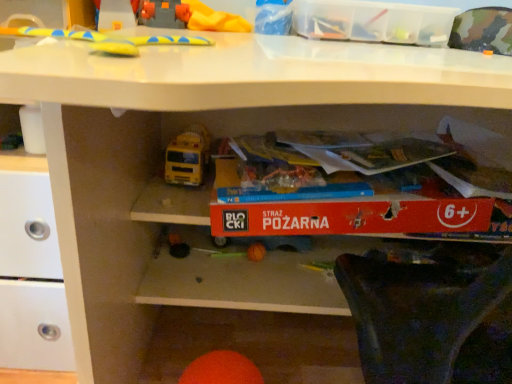
This screenshot has width=512, height=384. Describe the element at coordinates (106, 39) in the screenshot. I see `yellow rubber toy at upper center, the 2th toy in the bottom-to-top sequence` at that location.

Where is `transparent plastic storage box at upper center`? transparent plastic storage box at upper center is located at coordinates (373, 22).

You are a GUI agent. You are given a task and a screenshot of the screen. Output one action in this format:
    pyautogui.click(x=<x>, y=<y>)
    Task: Click on the yellow rubber toy at upper center, which appears as the 1th toy when viewed from the front
    The height and width of the screenshot is (384, 512).
    Given the screenshot: What is the action you would take?
    pyautogui.click(x=106, y=39)

Which of these two, yellow rubber toy at upper center, which is the 3th toy from bottom to top, or yellow rubber toy at upper center, which appears as the 1th toy when viewed from the front, stands taller?

yellow rubber toy at upper center, which is the 3th toy from bottom to top.

Is yellow rubber toy at upper center, which appears as the 1th toy when viewed from the front, surrounded by yellow rubber toy at upper center, which is the 3th toy from bottom to top?

No, yellow rubber toy at upper center, which appears as the 1th toy when viewed from the front, is not a part of yellow rubber toy at upper center, which is the 3th toy from bottom to top.

Is point (223, 16) positioned in front of point (203, 41)?

No.

Is yellow rubber toy at upper center, which is the 2th toy from top to bottom, at the back of yellow rubber toy at upper center, the first toy positioned from the top?

No, yellow rubber toy at upper center, the first toy positioned from the top,'s orientation is not away from yellow rubber toy at upper center, which is the 2th toy from top to bottom.

Is yellow rubber toy at upper center, acting as the 1th toy starting from the back, outside of transparent plastic storage box at upper center?

Yes, yellow rubber toy at upper center, acting as the 1th toy starting from the back, is not within transparent plastic storage box at upper center.

Considering the positions of point (243, 22) and point (436, 16), is point (243, 22) closer or farther from the camera than point (436, 16)?

Point (243, 22).

From a real-world perspective, relative to transparent plastic storage box at upper center, is yellow rubber toy at upper center, the first toy positioned from the top, vertically above or below?

yellow rubber toy at upper center, the first toy positioned from the top, is situated higher than transparent plastic storage box at upper center in the real world.

Locate an element on the screen. This screenshot has height=384, width=512. storage box directly beneath the yellow rubber toy at upper center, acting as the 1th toy starting from the back (from a real-world perspective) is located at coordinates (373, 22).

Locate an element on the screen. storage box on the right of yellow rubber toy at upper center, which appears as the 1th toy when viewed from the front is located at coordinates (373, 22).

From the image's perspective, is yellow rubber toy at upper center, which is the 2th toy from top to bottom, under transparent plastic storage box at upper center?

Yes, from the image's perspective, yellow rubber toy at upper center, which is the 2th toy from top to bottom, is beneath transparent plastic storage box at upper center.

Can you see yellow rubber toy at upper center, which is the 2th toy from top to bottom, touching transparent plastic storage box at upper center?

yellow rubber toy at upper center, which is the 2th toy from top to bottom, and transparent plastic storage box at upper center are not in contact.

Considering the relative sizes of yellow rubber toy at upper center, which appears as the 1th toy when viewed from the front, and transparent plastic storage box at upper center in the image provided, is yellow rubber toy at upper center, which appears as the 1th toy when viewed from the front, smaller than transparent plastic storage box at upper center?

Yes.

Which is behind, point (243, 357) or point (400, 20)?

The point (243, 357) is behind.

Considering the sizes of objects orange matte ball at lower center, the 2th toy viewed from the back, and transparent plastic storage box at upper center in the image provided, who is smaller, orange matte ball at lower center, the 2th toy viewed from the back, or transparent plastic storage box at upper center?

With smaller size is orange matte ball at lower center, the 2th toy viewed from the back.

The width and height of the screenshot is (512, 384). I want to click on storage box on the right of the orange matte ball at lower center, the third toy from the top, so click(373, 22).

Visually, is orange matte ball at lower center, the 1th toy when ordered from bottom to top, positioned to the left or to the right of transparent plastic storage box at upper center?

Clearly, orange matte ball at lower center, the 1th toy when ordered from bottom to top, is on the left of transparent plastic storage box at upper center in the image.

What's the angular difference between orange matte ball at lower center, the 2th toy viewed from the back, and yellow rubber toy at upper center, acting as the 1th toy starting from the back,'s facing directions?

17.4 degrees.

Is yellow rubber toy at upper center, the 3th toy when ordered from front to back, at the back of orange matte ball at lower center, the 1th toy when ordered from bottom to top?

orange matte ball at lower center, the 1th toy when ordered from bottom to top, is not turned away from yellow rubber toy at upper center, the 3th toy when ordered from front to back.

Locate an element on the screen. The image size is (512, 384). toy that is the 2nd one when counting upward from the orange matte ball at lower center, the 2th toy viewed from the back (from the image's perspective) is located at coordinates (210, 18).

Which of these two, orange matte ball at lower center, the second toy when ordered from front to back, or yellow rubber toy at upper center, acting as the 1th toy starting from the back, is wider?

yellow rubber toy at upper center, acting as the 1th toy starting from the back.

Is orange matte ball at lower center, the third toy from the top, wider than yellow rubber toy at upper center, which is counted as the 3th toy, starting from the back?

No.

Locate an element on the screen. This screenshot has height=384, width=512. toy in front of the orange matte ball at lower center, the 1th toy when ordered from bottom to top is located at coordinates (106, 39).

Is orange matte ball at lower center, the 2th toy viewed from the back, to the left or to the right of yellow rubber toy at upper center, which is counted as the 3th toy, starting from the back, in the image?

Clearly, orange matte ball at lower center, the 2th toy viewed from the back, is on the right of yellow rubber toy at upper center, which is counted as the 3th toy, starting from the back, in the image.

How much distance is there between yellow rubber toy at upper center, which is the 2th toy from top to bottom, and orange matte ball at lower center, the 2th toy viewed from the back?

They are 24.43 inches apart.

Which is more to the left, yellow rubber toy at upper center, which is counted as the 3th toy, starting from the back, or orange matte ball at lower center, the second toy when ordered from front to back?

yellow rubber toy at upper center, which is counted as the 3th toy, starting from the back, is more to the left.

From a real-world perspective, is yellow rubber toy at upper center, which appears as the 1th toy when viewed from the front, above or below orange matte ball at lower center, the second toy when ordered from front to back?

Clearly, from a real-world perspective, yellow rubber toy at upper center, which appears as the 1th toy when viewed from the front, is above orange matte ball at lower center, the second toy when ordered from front to back.

Is yellow rubber toy at upper center, which appears as the 1th toy when viewed from the front, next to orange matte ball at lower center, the second toy when ordered from front to back, and touching it?

yellow rubber toy at upper center, which appears as the 1th toy when viewed from the front, and orange matte ball at lower center, the second toy when ordered from front to back, are clearly separated.

The height and width of the screenshot is (384, 512). Identify the location of toy that is the 2nd one when counting backward from the yellow rubber toy at upper center, which is counted as the 3th toy, starting from the back. (210, 18).

At what (x,y) coordinates should I click in order to perform the action: click on the 2nd toy counting from the left side of the transparent plastic storage box at upper center. Please return your answer as a coordinate pair (x, y). Looking at the image, I should click on (210, 18).

From the image, which object appears to be farther from yellow rubber toy at upper center, which is the 3th toy from bottom to top, transparent plastic storage box at upper center or yellow rubber toy at upper center, which is the 2th toy from top to bottom?

transparent plastic storage box at upper center is further to yellow rubber toy at upper center, which is the 3th toy from bottom to top.

Looking at the image, which one is located closer to yellow rubber toy at upper center, the 3th toy when ordered from front to back, yellow rubber toy at upper center, which appears as the 1th toy when viewed from the front, or transparent plastic storage box at upper center?

yellow rubber toy at upper center, which appears as the 1th toy when viewed from the front.

From the image, which object appears to be farther from yellow rubber toy at upper center, the first toy positioned from the top, orange matte ball at lower center, the 1th toy when ordered from bottom to top, or transparent plastic storage box at upper center?

orange matte ball at lower center, the 1th toy when ordered from bottom to top, lies further to yellow rubber toy at upper center, the first toy positioned from the top, than the other object.

Considering their positions, is yellow rubber toy at upper center, which is the 2th toy from top to bottom, positioned closer to transparent plastic storage box at upper center than yellow rubber toy at upper center, the 3th toy when ordered from front to back?

yellow rubber toy at upper center, the 3th toy when ordered from front to back, is closer to transparent plastic storage box at upper center.

From the image, which object appears to be farther from transparent plastic storage box at upper center, orange matte ball at lower center, the 2th toy viewed from the back, or yellow rubber toy at upper center, which is the 2th toy from top to bottom?

Among the two, orange matte ball at lower center, the 2th toy viewed from the back, is located further to transparent plastic storage box at upper center.

Based on their spatial positions, is yellow rubber toy at upper center, acting as the 1th toy starting from the back, or yellow rubber toy at upper center, which is the 2th toy from top to bottom, closer to orange matte ball at lower center, the third toy from the top?

The object closer to orange matte ball at lower center, the third toy from the top, is yellow rubber toy at upper center, which is the 2th toy from top to bottom.

Which object lies further to the anchor point transparent plastic storage box at upper center, orange matte ball at lower center, the second toy when ordered from front to back, or yellow rubber toy at upper center, which is the 3th toy from bottom to top?

Based on the image, orange matte ball at lower center, the second toy when ordered from front to back, appears to be further to transparent plastic storage box at upper center.

From the image, which object appears to be nearer to yellow rubber toy at upper center, the 3th toy when ordered from front to back, transparent plastic storage box at upper center or orange matte ball at lower center, the 2th toy viewed from the back?

transparent plastic storage box at upper center is positioned closer to the anchor yellow rubber toy at upper center, the 3th toy when ordered from front to back.

Locate an element on the screen. The height and width of the screenshot is (384, 512). storage box between yellow rubber toy at upper center, the first toy positioned from the top, and orange matte ball at lower center, the 1th toy when ordered from bottom to top, in the vertical direction is located at coordinates click(373, 22).

The image size is (512, 384). Find the location of `toy that lies between transparent plastic storage box at upper center and orange matte ball at lower center, the third toy from the top, from top to bottom`. toy that lies between transparent plastic storage box at upper center and orange matte ball at lower center, the third toy from the top, from top to bottom is located at coordinates (106, 39).

The height and width of the screenshot is (384, 512). Identify the location of storage box between yellow rubber toy at upper center, which is counted as the 3th toy, starting from the back, and yellow rubber toy at upper center, the 3th toy when ordered from front to back, from front to back. (373, 22).

Locate an element on the screen. Image resolution: width=512 pixels, height=384 pixels. toy between yellow rubber toy at upper center, the 3th toy when ordered from front to back, and orange matte ball at lower center, the second toy when ordered from front to back, in the vertical direction is located at coordinates (106, 39).